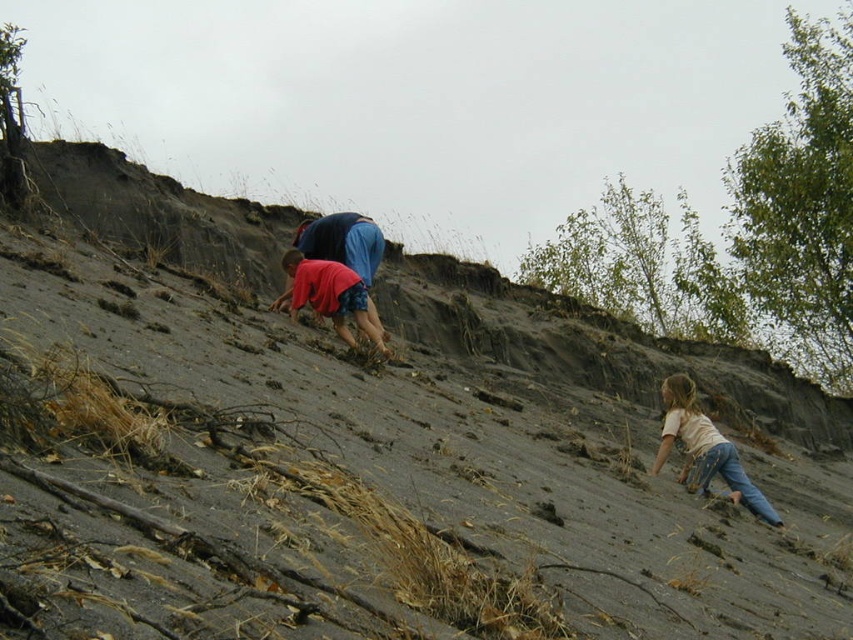
Is light beige denim jeans at lower right thinner than matte red shirt at center?

In fact, light beige denim jeans at lower right might be wider than matte red shirt at center.

At what (x,y) coordinates should I click in order to perform the action: click on light beige denim jeans at lower right. Please return your answer as a coordinate pair (x, y). Looking at the image, I should click on (704, 449).

You are a GUI agent. You are given a task and a screenshot of the screen. Output one action in this format:
    pyautogui.click(x=<x>, y=<y>)
    Task: Click on the light beige denim jeans at lower right
    This screenshot has height=640, width=853.
    Given the screenshot: What is the action you would take?
    pyautogui.click(x=704, y=449)